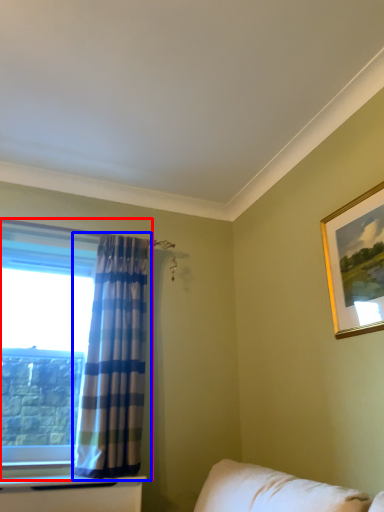
Question: Which of the following is the closest to the observer, window (highlighted by a red box) or curtain (highlighted by a blue box)?

Choices:
 (A) window
 (B) curtain

Answer: (B)